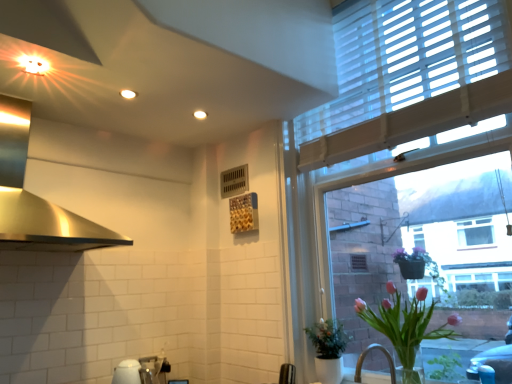
Question: Considering the positions of white textured window at upper right and green matte plant at lower right, the 2th houseplant viewed from the front, in the image, is white textured window at upper right wider or thinner than green matte plant at lower right, the 2th houseplant viewed from the front,?

Choices:
 (A) wide
 (B) thin

Answer: (B)

Question: Is white textured window at upper right inside or outside of green matte plant at lower right, the 2th houseplant viewed from the front?

Choices:
 (A) inside
 (B) outside

Answer: (B)

Question: Which object is the farthest from the pink glass vase at lower right, which is the first houseplant from front to back?

Choices:
 (A) polished stainless steel exhaust hood at upper left
 (B) white textured window at upper right
 (C) white glossy sink at lower center
 (D) green matte plant at lower right, the 2th houseplant viewed from the front

Answer: (A)

Question: Which is nearer to the white glossy sink at lower center?

Choices:
 (A) green matte plant at lower right, arranged as the first houseplant when viewed from the back
 (B) polished stainless steel exhaust hood at upper left
 (C) pink glass vase at lower right, which is the first houseplant from front to back
 (D) white textured window at upper right

Answer: (B)